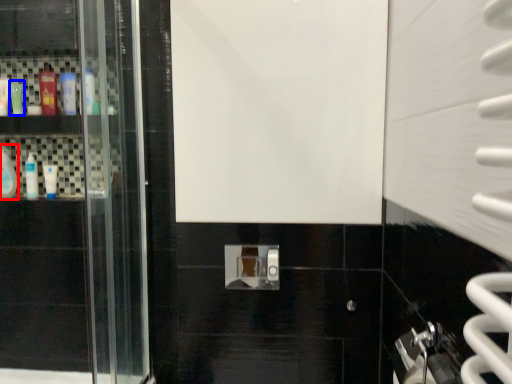
Question: Among these objects, which one is farthest to the camera, mouthwash (highlighted by a red box) or mouthwash (highlighted by a blue box)?

Choices:
 (A) mouthwash
 (B) mouthwash

Answer: (A)